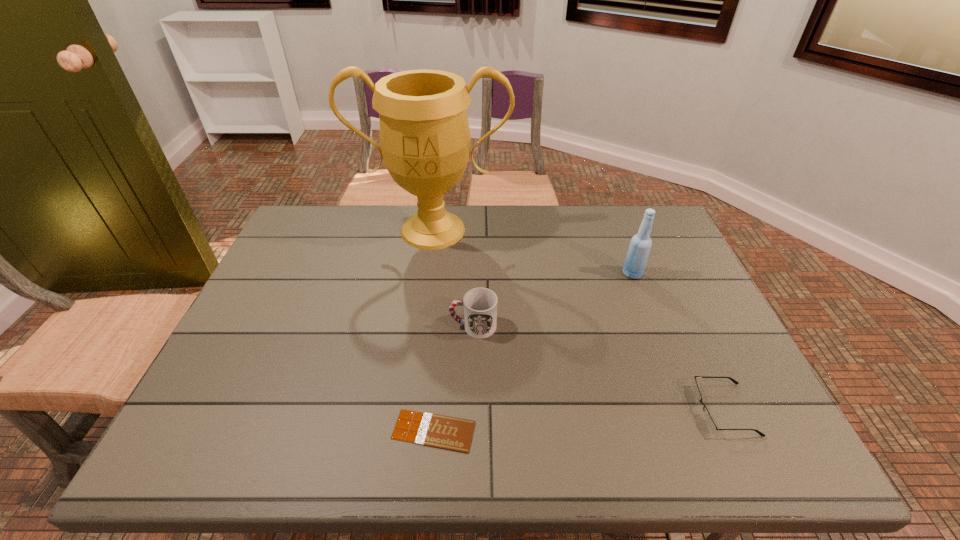
This screenshot has height=540, width=960. Find the location of `the farthest object`. the farthest object is located at coordinates (425, 139).

Locate an element on the screen. The width and height of the screenshot is (960, 540). trophy is located at coordinates (425, 139).

Find the location of a particular element. bottle is located at coordinates (640, 245).

Find the location of `the fourth shortest object`. the fourth shortest object is located at coordinates (640, 245).

The height and width of the screenshot is (540, 960). Find the location of `cup`. cup is located at coordinates (479, 305).

Identify the location of the third farthest object. (479, 305).

At what (x,y) coordinates should I click in order to perform the action: click on spectacles. Please return your answer as a coordinate pair (x, y). Looking at the image, I should click on (709, 422).

Image resolution: width=960 pixels, height=540 pixels. In order to click on the shortest object in this screenshot , I will do `click(445, 432)`.

Where is `vacant position located on the engravings side of the trophy`? This screenshot has width=960, height=540. vacant position located on the engravings side of the trophy is located at coordinates (425, 285).

The height and width of the screenshot is (540, 960). Identify the location of vacant space situated on the left of the fourth shortest object. (502, 274).